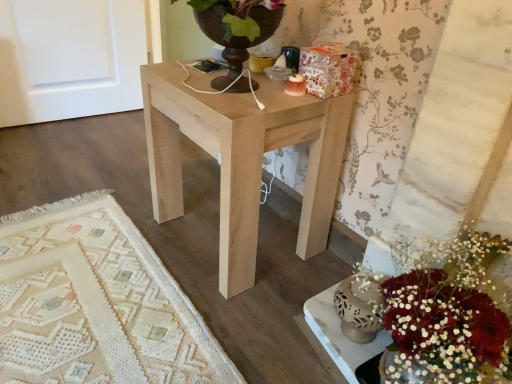
Describe the element at coordinates (242, 157) in the screenshot. I see `natural wood table at center` at that location.

The image size is (512, 384). I want to click on natural wood table at center, so click(242, 157).

In order to face natural wood table at center, should I rotate leftwards or rightwards?

Turn left by 2.683 degrees to look at natural wood table at center.

Locate an element on the screen. This screenshot has height=384, width=512. white matte vase at lower right is located at coordinates (446, 311).

The height and width of the screenshot is (384, 512). Describe the element at coordinates (446, 311) in the screenshot. I see `white matte vase at lower right` at that location.

Identify the location of natural wood table at center. This screenshot has width=512, height=384. (242, 157).

Considering the positions of objects white matte vase at lower right and natural wood table at center in the image provided, who is more to the left, white matte vase at lower right or natural wood table at center?

natural wood table at center is more to the left.

In the image, is white matte vase at lower right positioned in front of or behind natural wood table at center?

Visually, white matte vase at lower right is located in front of natural wood table at center.

Is point (481, 233) closer to viewer compared to point (174, 202)?

Yes, point (481, 233) is closer to viewer.

From the image's perspective, which one is positioned lower, white matte vase at lower right or natural wood table at center?

white matte vase at lower right appears lower in the image.

From a real-world perspective, is white matte vase at lower right located beneath natural wood table at center?

Yes, from a real-world perspective, white matte vase at lower right is under natural wood table at center.

Which object is thinner, white matte vase at lower right or natural wood table at center?

white matte vase at lower right.

Considering the sizes of white matte vase at lower right and natural wood table at center in the image, is white matte vase at lower right taller or shorter than natural wood table at center?

In the image, white matte vase at lower right appears to be shorter than natural wood table at center.

Does white matte vase at lower right have a smaller size compared to natural wood table at center?

Indeed, white matte vase at lower right has a smaller size compared to natural wood table at center.

Do you think white matte vase at lower right is within natural wood table at center, or outside of it?

white matte vase at lower right is not inside natural wood table at center, it's outside.

Is white matte vase at lower right beside natural wood table at center?

No.

Is white matte vase at lower right looking in the opposite direction of natural wood table at center?

No, white matte vase at lower right is not facing the opposite direction of natural wood table at center.

Can you tell me how much white matte vase at lower right and natural wood table at center differ in facing direction?

The facing directions of white matte vase at lower right and natural wood table at center are 4.15 degrees apart.

Identify the location of flower on the right of natural wood table at center. The height and width of the screenshot is (384, 512). (446, 311).

In the image, is natural wood table at center on the left side or the right side of white matte vase at lower right?

Based on their positions, natural wood table at center is located to the left of white matte vase at lower right.

Is the position of natural wood table at center more distant than that of white matte vase at lower right?

Yes, natural wood table at center is further from the viewer.

Considering the positions of points (247, 240) and (402, 344), is point (247, 240) farther from camera compared to point (402, 344)?

Yes.

From the image's perspective, would you say natural wood table at center is shown under white matte vase at lower right?

No, from the image's perspective, natural wood table at center is not below white matte vase at lower right.

From a real-world perspective, is natural wood table at center physically below white matte vase at lower right?

No, from a real-world perspective, natural wood table at center is not below white matte vase at lower right.

Which object is thinner, natural wood table at center or white matte vase at lower right?

white matte vase at lower right.

Is natural wood table at center taller or shorter than white matte vase at lower right?

Clearly, natural wood table at center is taller compared to white matte vase at lower right.

Can you confirm if natural wood table at center is bigger than white matte vase at lower right?

Yes, natural wood table at center is bigger than white matte vase at lower right.

Is natural wood table at center positioned beyond the bounds of white matte vase at lower right?

Yes, natural wood table at center is not within white matte vase at lower right.

Are natural wood table at center and white matte vase at lower right far apart?

That's not correct — natural wood table at center is a little close to white matte vase at lower right.

Is natural wood table at center looking in the opposite direction of white matte vase at lower right?

No.

Looking at this image, how many degrees apart are the facing directions of natural wood table at center and white matte vase at lower right?

The angular difference between natural wood table at center and white matte vase at lower right is 4.15 degrees.

This screenshot has width=512, height=384. I want to click on flower that is in front of the natural wood table at center, so point(446,311).

Where is `flower below the natural wood table at center (from a real-world perspective)`? The height and width of the screenshot is (384, 512). flower below the natural wood table at center (from a real-world perspective) is located at coordinates (446, 311).

Locate an element on the screen. flower that appears in front of the natural wood table at center is located at coordinates (446, 311).